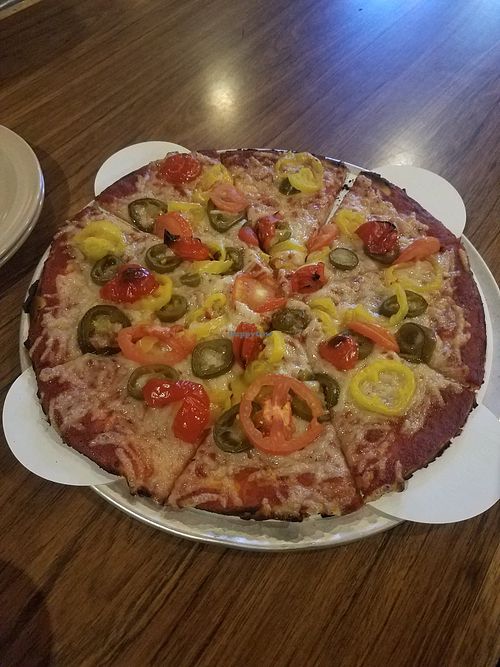
You are a GUI agent. You are given a task and a screenshot of the screen. Output one action in this format:
    pyautogui.click(x=<x>, y=<y>)
    Task: Click on the wooden table
    
    Given the screenshot: What is the action you would take?
    (x=324, y=89)